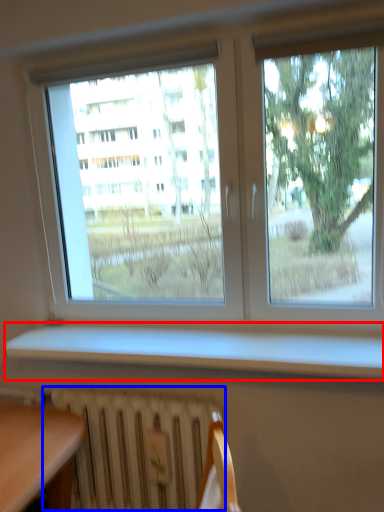
Question: Which object appears farthest to the camera in this image, window sill (highlighted by a red box) or radiator (highlighted by a blue box)?

Choices:
 (A) window sill
 (B) radiator

Answer: (B)